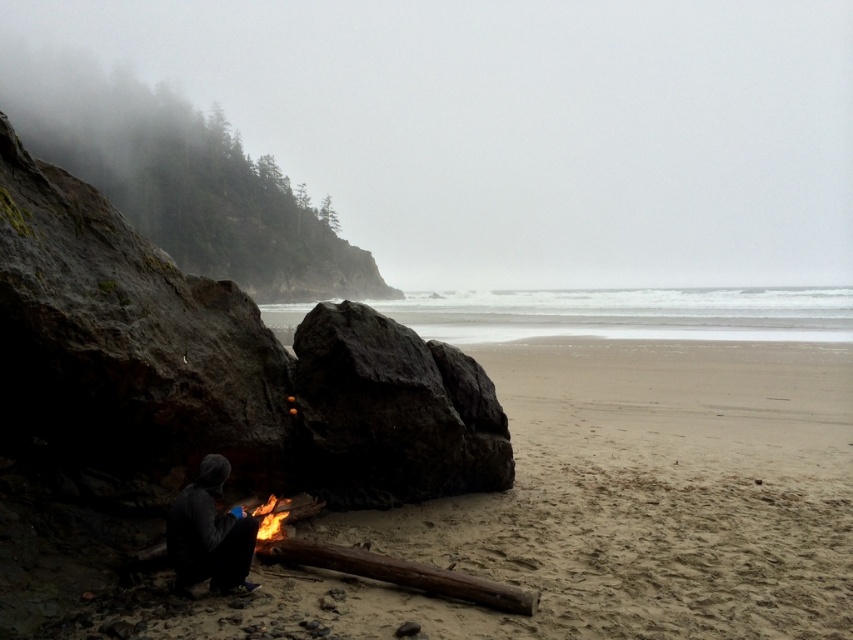
Which of these two, dark gray rock at center or dark gray hoodie at lower left, stands shorter?

dark gray hoodie at lower left

Based on the photo, is dark gray rock at center wider than dark gray hoodie at lower left?

Yes.

Between point (416, 472) and point (190, 580), which one is positioned behind?

Positioned behind is point (416, 472).

At what (x,y) coordinates should I click in order to perform the action: click on dark gray rock at center. Please return your answer as a coordinate pair (x, y). Image resolution: width=853 pixels, height=640 pixels. Looking at the image, I should click on (392, 412).

Who is more distant from viewer, (x=747, y=374) or (x=480, y=429)?

The point (x=747, y=374) is behind.

Who is more forward, (569,593) or (450,426)?

Point (569,593) is in front.

Locate an element on the screen. The width and height of the screenshot is (853, 640). smooth sand beach at lower left is located at coordinates (618, 504).

Does smooth sand beach at lower left have a larger size compared to dark gray hoodie at lower left?

Correct, smooth sand beach at lower left is larger in size than dark gray hoodie at lower left.

Where is `smooth sand beach at lower left`? Image resolution: width=853 pixels, height=640 pixels. smooth sand beach at lower left is located at coordinates (618, 504).